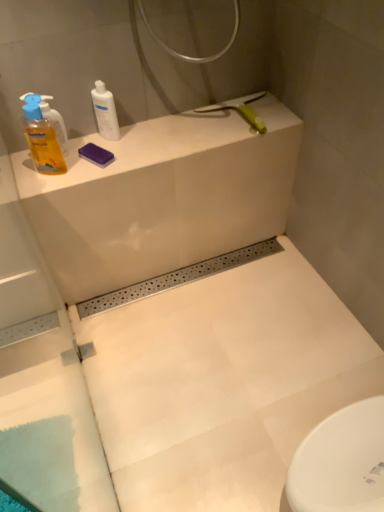
In order to click on free space in front of white glossy bottle at upper left, arranged as the 2th cleaning product when viewed from the left in this screenshot , I will do `click(100, 163)`.